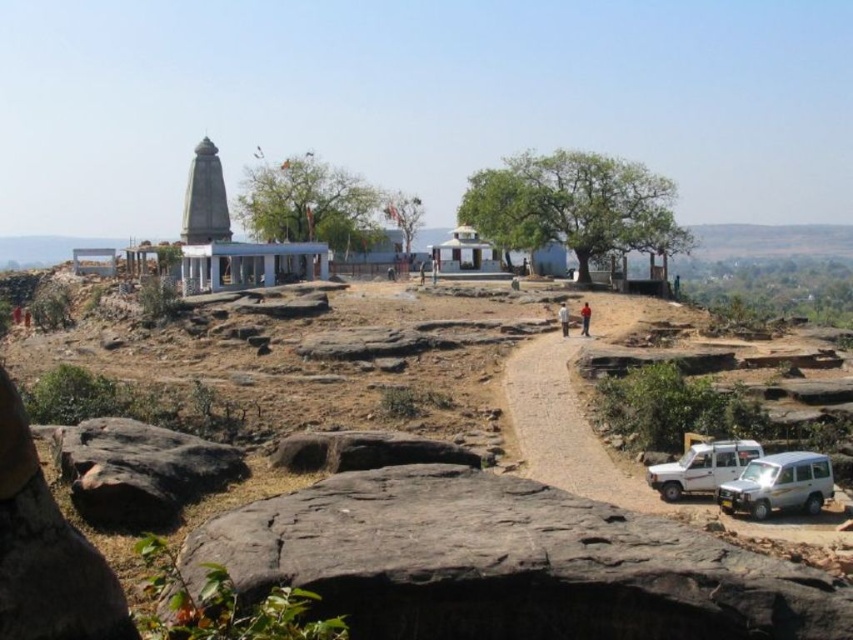
Question: Does brown rocky path at center appear on the left side of matte silver jeep at lower right?

Choices:
 (A) no
 (B) yes

Answer: (B)

Question: Does black rough rock at lower left appear under brown leather jacket at center?

Choices:
 (A) yes
 (B) no

Answer: (A)

Question: Which object is positioned farthest from the dark gray rock at lower center?

Choices:
 (A) brown leather jacket at center
 (B) brown rocky path at center

Answer: (A)

Question: Which of the following is the closest to the observer?

Choices:
 (A) (415, 474)
 (B) (120, 509)
 (C) (584, 332)

Answer: (B)

Question: Which object is closer to the camera taking this photo?

Choices:
 (A) white matte jeep at lower right
 (B) dark gray rock at lower center
 (C) matte silver jeep at lower right
 (D) brown fabric shirt at upper center

Answer: (B)

Question: Does black rough rock at lower left have a lesser width compared to brown fabric shirt at upper center?

Choices:
 (A) yes
 (B) no

Answer: (B)